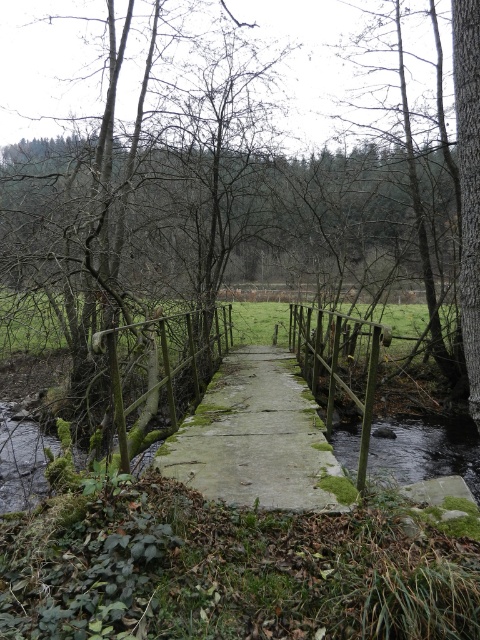
Question: Is green mossy tree at center positioned before mossy concrete bridge at center?

Choices:
 (A) no
 (B) yes

Answer: (A)

Question: Which point appears closest to the camera in this image?

Choices:
 (A) (64, 16)
 (B) (228, 404)

Answer: (B)

Question: Which of the following is the closest to the observer?

Choices:
 (A) green mossy tree at center
 (B) mossy concrete bridge at center

Answer: (B)

Question: Can you confirm if green mossy tree at center is positioned to the left of mossy concrete bridge at center?

Choices:
 (A) yes
 (B) no

Answer: (A)

Question: Can you confirm if green mossy tree at center is thinner than mossy concrete bridge at center?

Choices:
 (A) no
 (B) yes

Answer: (A)